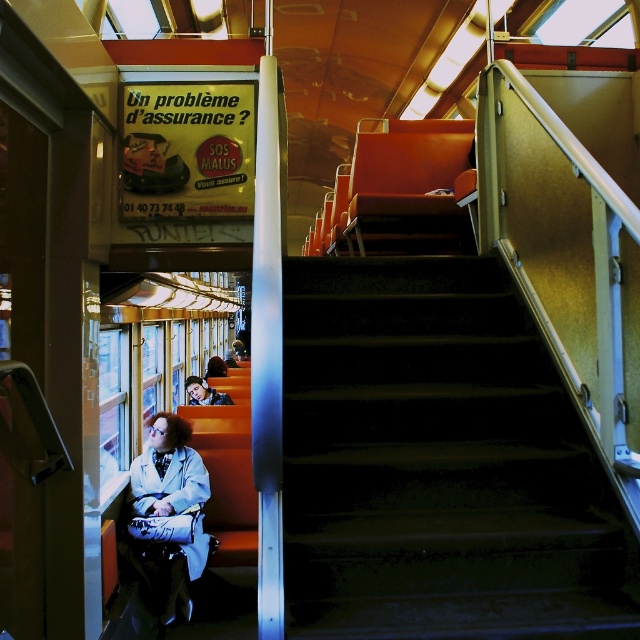
Question: Which of the following is the farthest from the observer?

Choices:
 (A) (154, 428)
 (B) (364, 550)

Answer: (A)

Question: Does dark green carpeted stairs at center appear under white matte coat at lower left?

Choices:
 (A) yes
 (B) no

Answer: (B)

Question: From the image, what is the correct spatial relationship of dark green carpeted stairs at center in relation to white matte coat at lower left?

Choices:
 (A) below
 (B) above

Answer: (B)

Question: Which object is farther from the camera taking this photo?

Choices:
 (A) white matte coat at lower left
 (B) dark green carpeted stairs at center

Answer: (A)

Question: Is dark green carpeted stairs at center thinner than white matte coat at lower left?

Choices:
 (A) no
 (B) yes

Answer: (A)